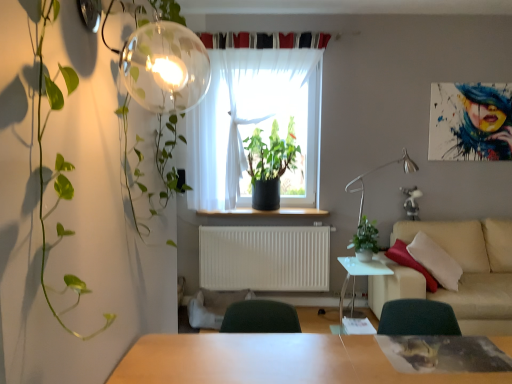
You are a GUI agent. You are given a task and a screenshot of the screen. Output one action in this format:
    pyautogui.click(x=<x>, y=<y>)
    Task: Click on the free point above white matte radiator at center (from a real-world perspective)
    The image size is (512, 384).
    Given the screenshot: What is the action you would take?
    pyautogui.click(x=258, y=223)